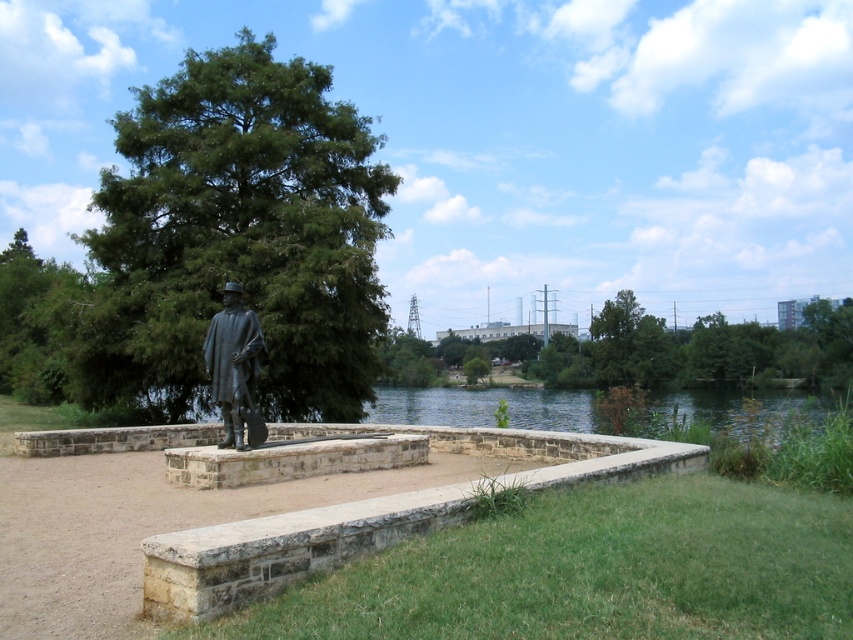
Can you confirm if stone ledge at center is positioned to the right of green leafy tree at upper center?

In fact, stone ledge at center is to the left of green leafy tree at upper center.

Describe the element at coordinates (282, 548) in the screenshot. I see `stone ledge at center` at that location.

Locate an element on the screen. stone ledge at center is located at coordinates (282, 548).

Between point (259, 272) and point (299, 556), which one is positioned behind?

Point (259, 272)

Where is `green matte tree at center`? green matte tree at center is located at coordinates (236, 237).

Which is behind, point (105, 301) or point (297, 563)?

Point (105, 301)

You are a GUI agent. You are given a task and a screenshot of the screen. Output one action in this format:
    pyautogui.click(x=<x>, y=<y>)
    Task: Click on the green matte tree at center
    
    Given the screenshot: What is the action you would take?
    pyautogui.click(x=236, y=237)

Can you confirm if stone ledge at center is taller than bronze statue at center?

Incorrect, stone ledge at center's height is not larger of bronze statue at center's.

Based on the photo, who is more distant from viewer, (328, 428) or (222, 298)?

Point (222, 298)

The image size is (853, 640). In order to click on stone ledge at center in this screenshot , I will do `click(282, 548)`.